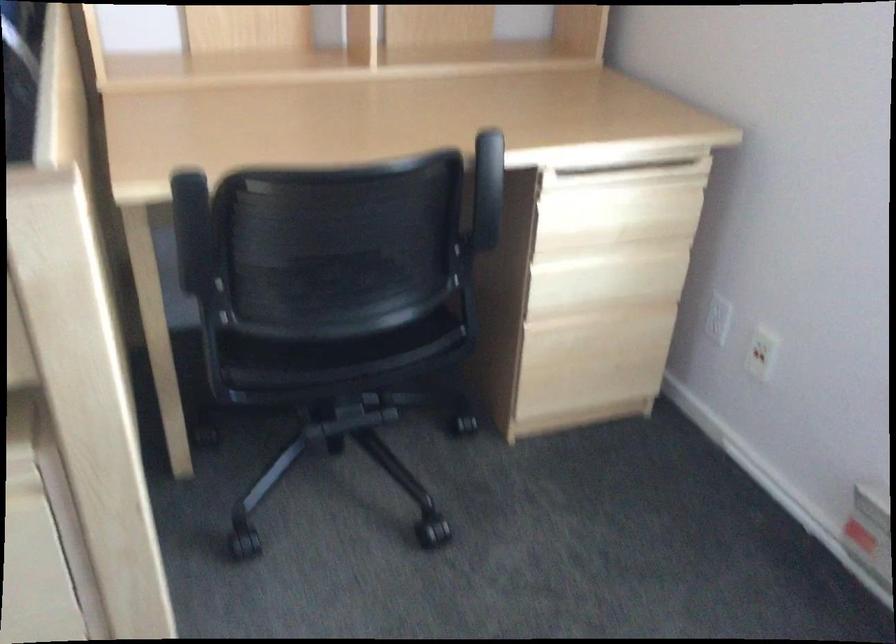
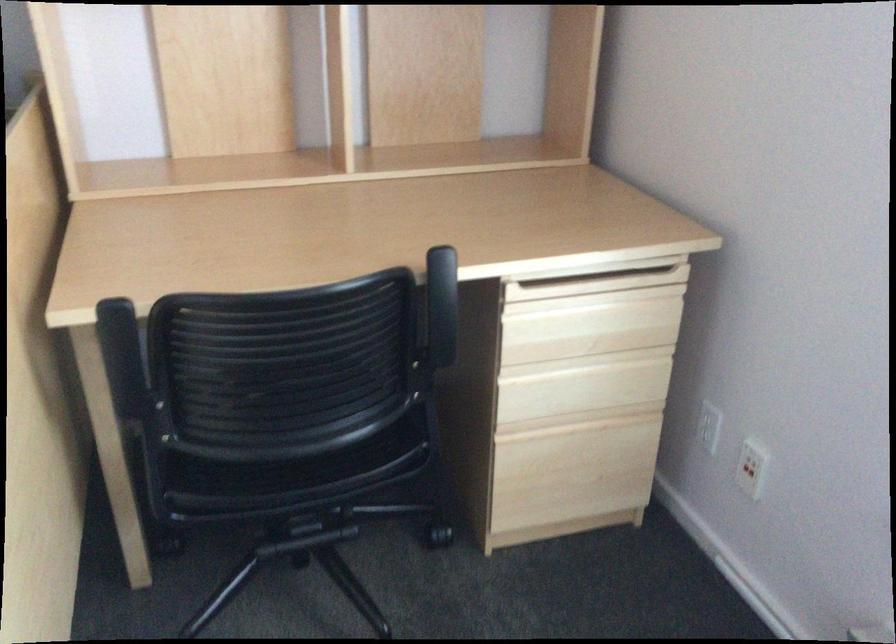
The point at (488, 192) is marked in the first image. Where is the corresponding point in the second image?

(441, 306)